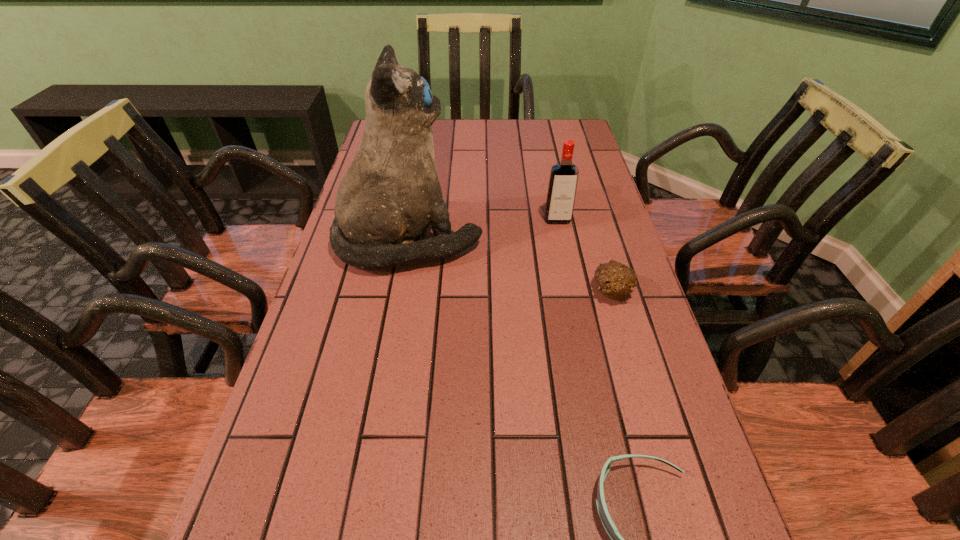
Locate an element on the screen. This screenshot has width=960, height=540. vacant space at the far edge of the desktop is located at coordinates (475, 151).

Locate an element on the screen. This screenshot has height=540, width=960. vacant region at the left edge of the desktop is located at coordinates (365, 383).

In the image, there is a desktop. Where is `vacant area at the right edge`? vacant area at the right edge is located at coordinates (622, 234).

Image resolution: width=960 pixels, height=540 pixels. In the image, there is a desktop. What are the coordinates of `vacant space at the far right corner` in the screenshot? It's located at (555, 147).

This screenshot has height=540, width=960. I want to click on free point between the vodka and the cat, so click(483, 230).

This screenshot has width=960, height=540. Find the location of `free spot between the vodka and the muffin`. free spot between the vodka and the muffin is located at coordinates (585, 255).

Locate which object is the second closest to the cat. Please provide its 2D coordinates. Your answer should be formatted as a tuple, i.e. [(x, y)], where the tuple contains the x and y coordinates of a point satisfying the conditions above.

[(615, 279)]

Identify which object is located as the third nearest to the muffin. Please provide its 2D coordinates. Your answer should be formatted as a tuple, i.e. [(x, y)], where the tuple contains the x and y coordinates of a point satisfying the conditions above.

[(617, 539)]

Where is `free space that satisfies the following two spatial constraints: 1. on the front and back of the muffin; 2. on the left side of the vodka`? This screenshot has height=540, width=960. free space that satisfies the following two spatial constraints: 1. on the front and back of the muffin; 2. on the left side of the vodka is located at coordinates (572, 291).

You are a GUI agent. You are given a task and a screenshot of the screen. Output one action in this format:
    pyautogui.click(x=<x>, y=<y>)
    Task: Click on the free space in the image that satisfies the following two spatial constraints: 1. on the back side of the second shortest object; 2. at the face of the cat
    This screenshot has height=540, width=960.
    Given the screenshot: What is the action you would take?
    pyautogui.click(x=597, y=241)